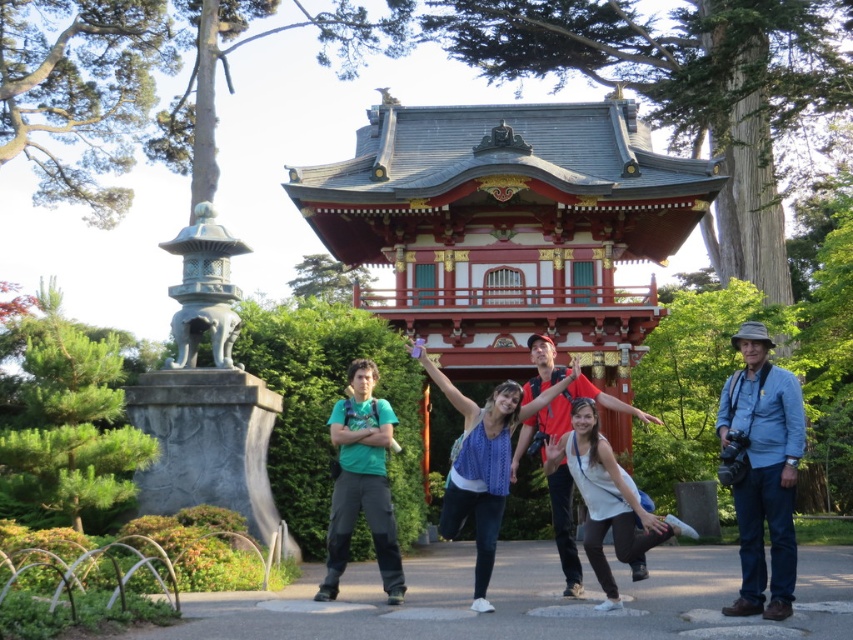
Who is more distant from viewer, (752,566) or (606,577)?

Positioned behind is point (606,577).

Between blue denim jeans at right and white cotton dress at center, which one appears on the left side from the viewer's perspective?

From the viewer's perspective, white cotton dress at center appears more on the left side.

Where is `blue denim jeans at right`? blue denim jeans at right is located at coordinates (762, 470).

You are a GUI agent. You are given a task and a screenshot of the screen. Output one action in this format:
    pyautogui.click(x=<x>, y=<y>)
    Task: Click on the blue denim jeans at right
    
    Given the screenshot: What is the action you would take?
    pyautogui.click(x=762, y=470)

The width and height of the screenshot is (853, 640). Describe the element at coordinates (762, 470) in the screenshot. I see `blue denim jeans at right` at that location.

Does blue denim jeans at right appear over green matte t-shirt at center?

Actually, blue denim jeans at right is below green matte t-shirt at center.

What are the coordinates of `blue denim jeans at right` in the screenshot? It's located at (762, 470).

Which is in front, point (393, 540) or point (596, 432)?

Point (393, 540) is more forward.

Does point (331, 436) come in front of point (578, 484)?

No.

In order to click on green matte t-shirt at center in this screenshot , I will do `click(361, 483)`.